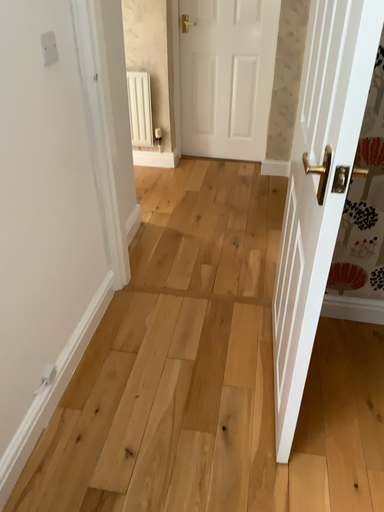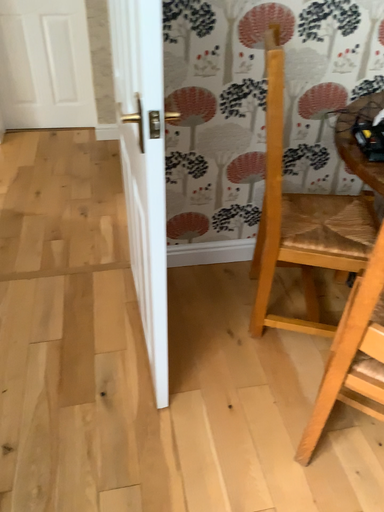
Question: Which way did the camera rotate in the video?

Choices:
 (A) rotated right
 (B) rotated left

Answer: (A)